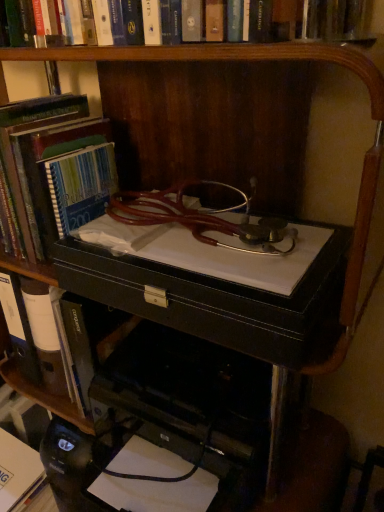
Question: Relative to black leather computer desk at center, is blue striped notebook at center, which appears as the 3th book when ordered from the bottom, in front or behind?

Choices:
 (A) front
 (B) behind

Answer: (B)

Question: From the image's perspective, is blue striped notebook at center, which appears as the 3th book when ordered from the bottom, above or below black leather computer desk at center?

Choices:
 (A) above
 (B) below

Answer: (A)

Question: Which object is the farthest from the blue striped notebook at center, the 1th book in the top-to-bottom sequence?

Choices:
 (A) black leather computer desk at center
 (B) black leather book at center, arranged as the 2th book when viewed from the top
 (C) white paper at lower left, which ranks as the first book in bottom-to-top order
 (D) black leather drawer at center

Answer: (C)

Question: Estimate the real-world distances between objects in this image. Which object is closer to the black leather drawer at center?

Choices:
 (A) blue striped notebook at center, which appears as the 3th book when ordered from the bottom
 (B) white paper at lower left, marked as the third book in a top-to-bottom arrangement
 (C) black leather computer desk at center
 (D) black leather book at center, marked as the 2th book in a bottom-to-top arrangement

Answer: (C)